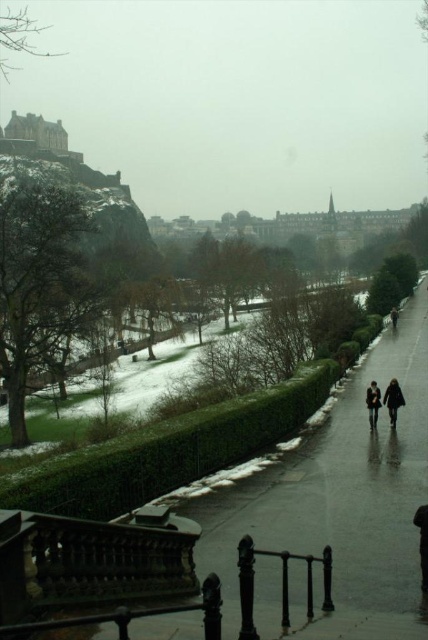
You are a photographer planning to capture both the dark fabric coat at center and the dark brown leather coat at lower center in a single frame. Given their sizes, which coat should you position closer to the camera to ensure both appear equally sized in the photo?

The dark brown leather coat at lower center should be positioned closer to the camera since it is narrower than the dark fabric coat at center. By placing the smaller coat closer, their apparent sizes in the photo will balance out.

You are a photographer trying to capture both the dark fabric coat at center and the dark brown leather jacket at lower right in the same frame. Given their sizes, which one would appear closer to the camera?

The dark fabric coat at center appears closer to the camera because smaller objects in a photograph typically appear closer when they are actually smaller in size.